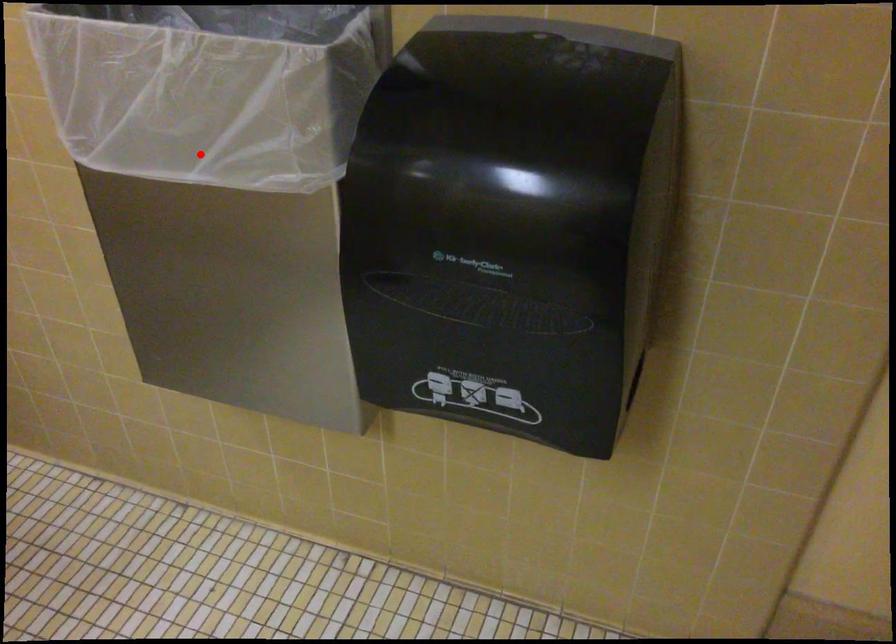
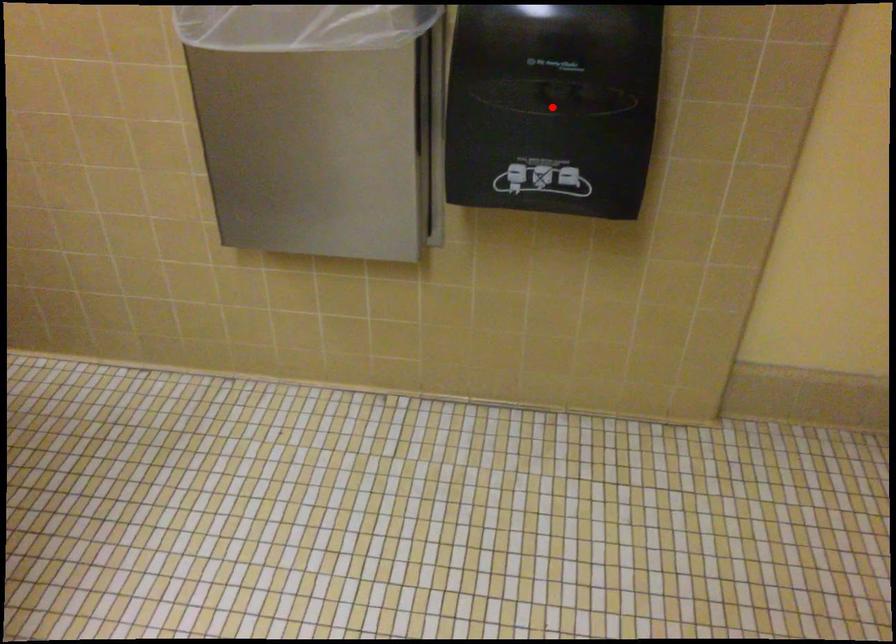
I am providing you with two images of the same scene from different viewpoints. A red point is marked on the first image and another point is marked on the second image. Do the highlighted points in image1 and image2 indicate the same real-world spot?

No